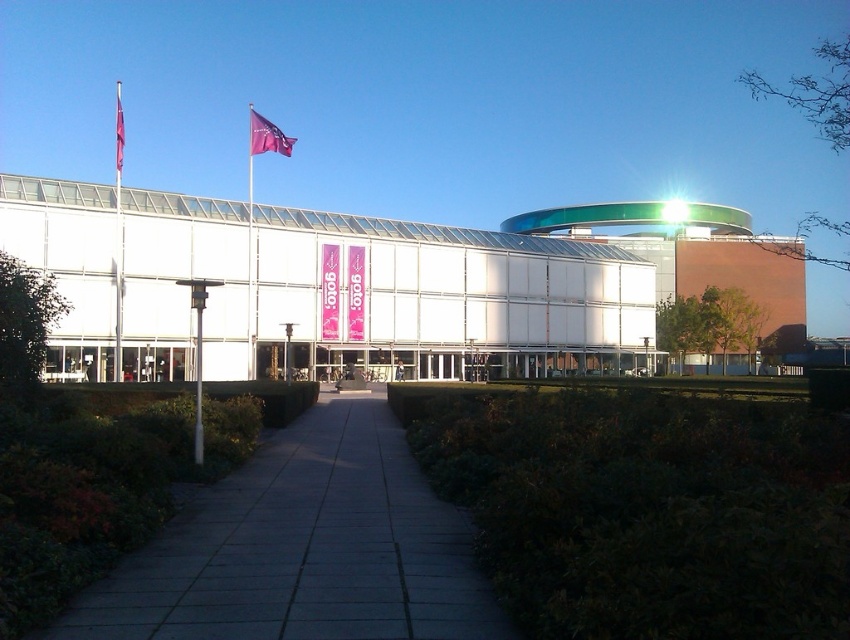
Is metallic flag pole at left further to the viewer compared to matte purple flag at upper center?

A: No, it is in front of matte purple flag at upper center.

Which is behind, point (120, 150) or point (119, 134)?

Point (119, 134)

Who is more forward, (119,177) or (116,147)?

Positioned in front is point (119,177).

You are a GUI agent. You are given a task and a screenshot of the screen. Output one action in this format:
    pyautogui.click(x=<x>, y=<y>)
    Task: Click on the metallic flag pole at left
    
    Given the screenshot: What is the action you would take?
    pyautogui.click(x=119, y=232)

Does point (119, 348) come closer to viewer compared to point (248, 147)?

Yes, it is in front of point (248, 147).

Who is higher up, metallic flag pole at left or purple fabric flag at upper left?

purple fabric flag at upper left is higher up.

Between point (115, 116) and point (279, 150), which one is positioned in front?

Point (279, 150) is more forward.

The image size is (850, 640). I want to click on metallic flag pole at left, so click(x=119, y=232).

Between purple fabric flag at upper left and matte purple flag at upper center, which one appears on the left side from the viewer's perspective?

Positioned to the left is matte purple flag at upper center.

Between purple fabric flag at upper left and matte purple flag at upper center, which one is positioned lower?

Positioned lower is purple fabric flag at upper left.

Locate an element on the screen. purple fabric flag at upper left is located at coordinates (267, 136).

The image size is (850, 640). I want to click on purple fabric flag at upper left, so click(x=267, y=136).